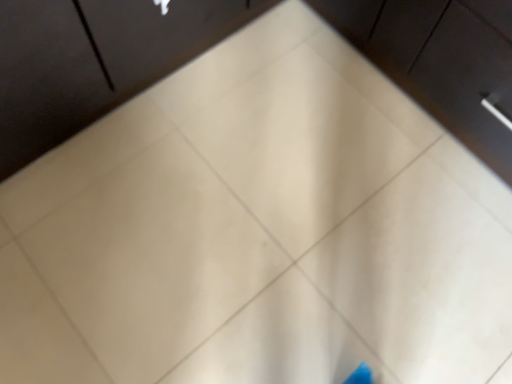
Describe the element at coordinates (94, 61) in the screenshot. I see `matte black file cabinet at upper left` at that location.

This screenshot has width=512, height=384. What are the coordinates of `matte black file cabinet at upper left` in the screenshot? It's located at (94, 61).

The height and width of the screenshot is (384, 512). I want to click on matte black file cabinet at upper left, so click(94, 61).